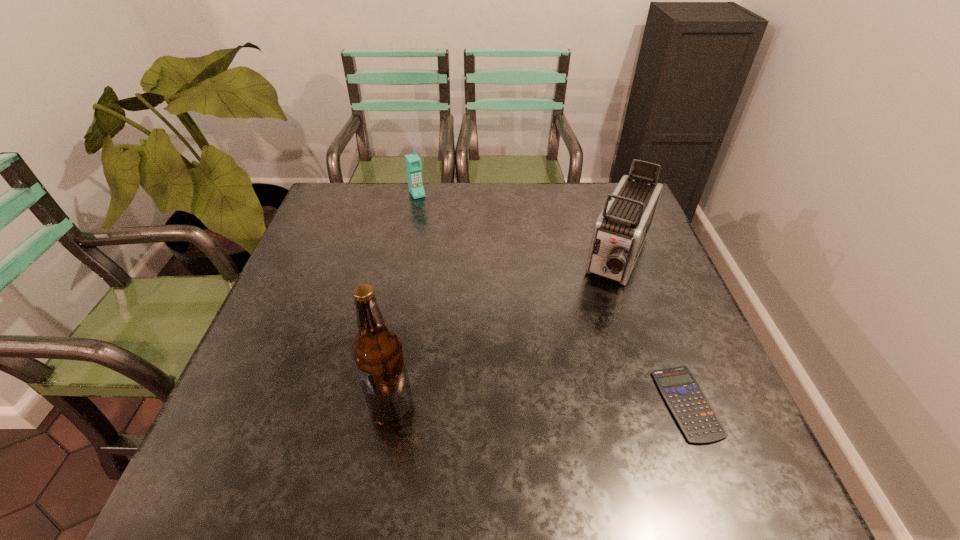
Image resolution: width=960 pixels, height=540 pixels. What are the coordinates of `vacant space on the desktop that is between the tallest object and the calculator and is positioned at the lens of the camcorder` in the screenshot? It's located at [x=549, y=404].

At what (x,y) coordinates should I click in order to perform the action: click on vacant space on the desktop that is between the beer bottle and the calculator and is positioned on the keypad of the cellular telephone. Please return your answer as a coordinate pair (x, y). The width and height of the screenshot is (960, 540). Looking at the image, I should click on (552, 404).